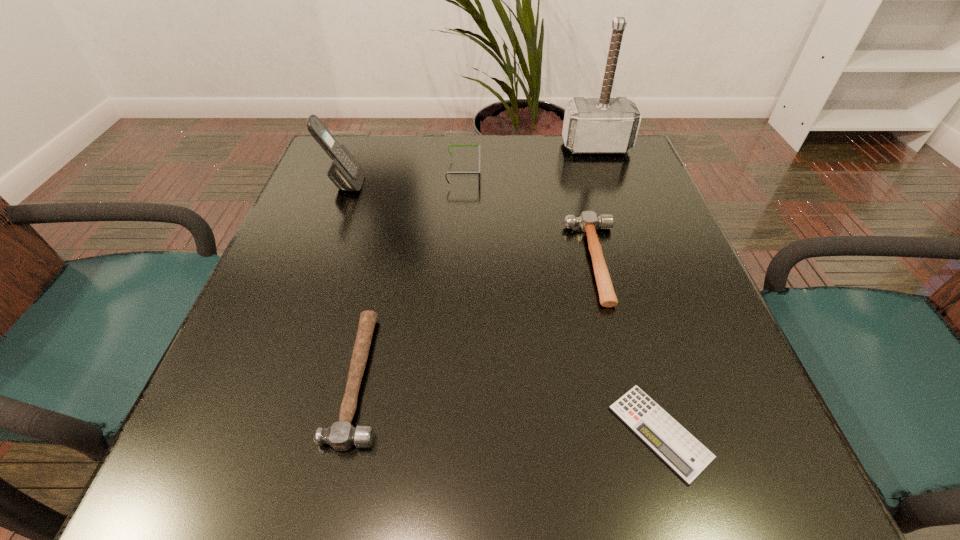
You are a GUI agent. You are given a task and a screenshot of the screen. Output one action in this format:
    pyautogui.click(x=<x>, y=<y>)
    Task: Click on the free space in the image that satisfies the following two spatial constraints: 1. on the lens of the third tallest object; 2. on the back side of the third nearest object
    This screenshot has width=960, height=540.
    Given the screenshot: What is the action you would take?
    pyautogui.click(x=460, y=261)

Identify the location of blank space that satisfies the following two spatial constraints: 1. on the striking face of the second object from left to right; 2. on the back side of the shortest object. (348, 432).

Image resolution: width=960 pixels, height=540 pixels. I want to click on vacant space that satisfies the following two spatial constraints: 1. on the front side of the third nearest object; 2. on the striking face of the leftmost hammer, so click(x=626, y=377).